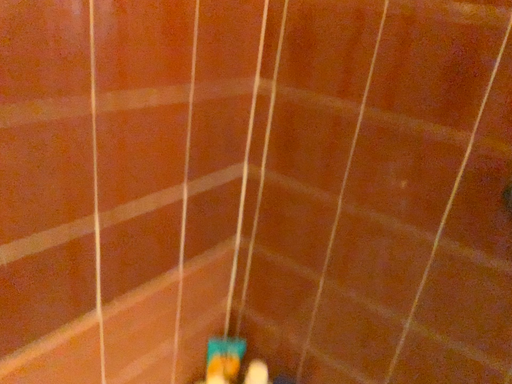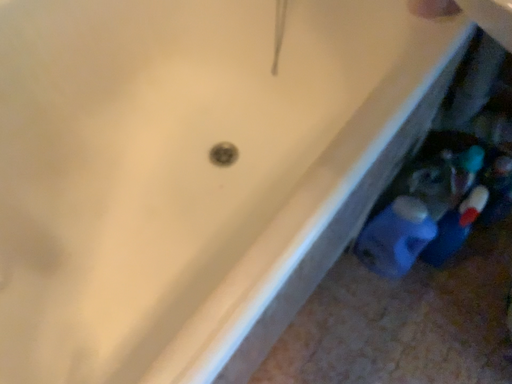
Question: Which way did the camera rotate in the video?

Choices:
 (A) rotated downward
 (B) rotated upward

Answer: (A)